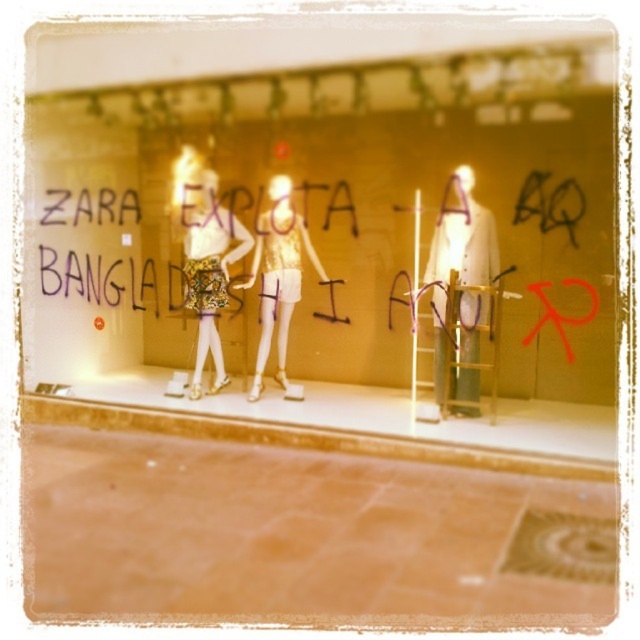
Question: Does gold sequined dress at center appear on the right side of metallic gold dress at center?

Choices:
 (A) no
 (B) yes

Answer: (A)

Question: Which of these objects is positioned farthest from the matte white mannequin at center?

Choices:
 (A) white fabric coat at center
 (B) metallic gold dress at center
 (C) gold sequined dress at center

Answer: (A)

Question: Among these objects, which one is nearest to the camera?

Choices:
 (A) white fabric coat at center
 (B) gold sequined dress at center
 (C) metallic gold dress at center

Answer: (A)

Question: Is white fabric coat at center to the left of gold sequined dress at center from the viewer's perspective?

Choices:
 (A) no
 (B) yes

Answer: (A)

Question: In this image, where is matte white mannequin at center located relative to gold sequined dress at center?

Choices:
 (A) right
 (B) left

Answer: (A)

Question: Based on their relative distances, which object is farther from the metallic gold dress at center?

Choices:
 (A) white fabric coat at center
 (B) gold sequined dress at center

Answer: (A)